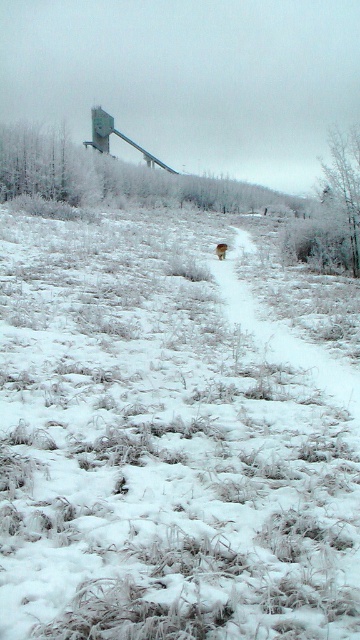
Question: Can you confirm if white fluffy snow at center is positioned above brown furry dog at center?

Choices:
 (A) yes
 (B) no

Answer: (B)

Question: Does white fluffy snow at center come behind brown furry dog at center?

Choices:
 (A) no
 (B) yes

Answer: (A)

Question: Which point is closer to the camera taking this photo?

Choices:
 (A) (156, 502)
 (B) (217, 256)

Answer: (A)

Question: Among these objects, which one is farthest from the camera?

Choices:
 (A) white fluffy snow at center
 (B) brown furry dog at center

Answer: (B)

Question: Is white fluffy snow at center wider than brown furry dog at center?

Choices:
 (A) no
 (B) yes

Answer: (B)

Question: Among these points, which one is farthest from the camera?

Choices:
 (A) (223, 257)
 (B) (159, 516)

Answer: (A)